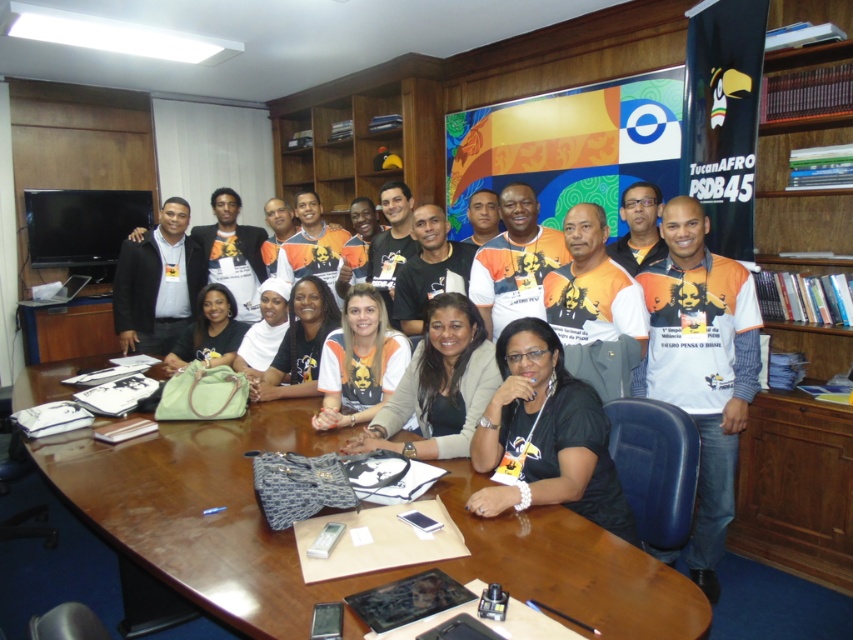
Between white printed t-shirt at right and black matte shirt at center, which one appears on the left side from the viewer's perspective?

black matte shirt at center

Is white printed t-shirt at right further to camera compared to black matte shirt at center?

That is True.

Locate an element on the screen. The height and width of the screenshot is (640, 853). white printed t-shirt at right is located at coordinates (701, 364).

Does point (512, 560) lie behind point (585, 433)?

No, (512, 560) is in front of (585, 433).

Is wooden table at center bigger than black matte shirt at center?

Correct, wooden table at center is larger in size than black matte shirt at center.

Describe the element at coordinates (293, 538) in the screenshot. Image resolution: width=853 pixels, height=640 pixels. I see `wooden table at center` at that location.

Where is `wooden table at center`? This screenshot has width=853, height=640. wooden table at center is located at coordinates (293, 538).

Does wooden table at center appear on the left side of white printed t-shirt at right?

Indeed, wooden table at center is positioned on the left side of white printed t-shirt at right.

Is point (187, 552) positioned before point (715, 316)?

Yes, it is in front of point (715, 316).

Image resolution: width=853 pixels, height=640 pixels. I want to click on wooden table at center, so click(293, 538).